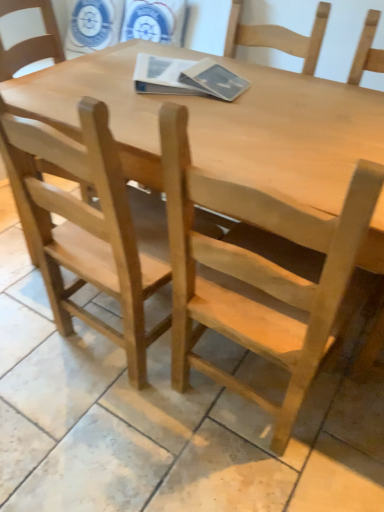
I want to click on vacant space in natural wood chair at left, the 2th chair viewed from the right (from a real-world perspective), so click(99, 342).